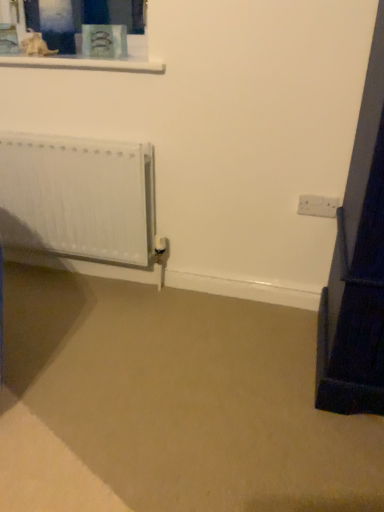
Describe the element at coordinates (317, 206) in the screenshot. I see `white plastic electric outlet at right` at that location.

Identify the location of white plastic electric outlet at right. (317, 206).

I want to click on white matte radiator at left, so click(78, 197).

The height and width of the screenshot is (512, 384). What do you see at coordinates (78, 197) in the screenshot?
I see `white matte radiator at left` at bounding box center [78, 197].

Where is `white plastic electric outlet at right`? white plastic electric outlet at right is located at coordinates (317, 206).

Can you confirm if white matte radiator at left is positioned to the left of white plastic electric outlet at right?

Yes, white matte radiator at left is to the left of white plastic electric outlet at right.

Based on the photo, is the position of white matte radiator at left less distant than that of white plastic electric outlet at right?

Yes, white matte radiator at left is in front of white plastic electric outlet at right.

Which is in front, point (85, 214) or point (313, 213)?

Point (313, 213)

From the image's perspective, which is below, white matte radiator at left or white plastic electric outlet at right?

white plastic electric outlet at right appears lower in the image.

From a real-world perspective, is white matte radiator at left physically located above or below white plastic electric outlet at right?

white matte radiator at left is situated lower than white plastic electric outlet at right in the real world.

Between white matte radiator at left and white plastic electric outlet at right, which one has smaller width?

white plastic electric outlet at right.

Is white matte radiator at left taller or shorter than white plastic electric outlet at right?

Clearly, white matte radiator at left is taller compared to white plastic electric outlet at right.

In terms of size, does white matte radiator at left appear bigger or smaller than white plastic electric outlet at right?

Considering their sizes, white matte radiator at left takes up more space than white plastic electric outlet at right.

Is white plastic electric outlet at right a part of white matte radiator at left?

No, white matte radiator at left does not contain white plastic electric outlet at right.

Is white matte radiator at left next to white plastic electric outlet at right and touching it?

white matte radiator at left and white plastic electric outlet at right are not in contact.

Looking at this image, is white matte radiator at left turned away from white plastic electric outlet at right?

white matte radiator at left is not turned away from white plastic electric outlet at right.

Identify the location of radiator above the white plastic electric outlet at right (from the image's perspective). The image size is (384, 512). (78, 197).

Considering the relative positions of white plastic electric outlet at right and white matte radiator at left in the image provided, is white plastic electric outlet at right to the left of white matte radiator at left from the viewer's perspective?

In fact, white plastic electric outlet at right is to the right of white matte radiator at left.

Who is more distant, white plastic electric outlet at right or white matte radiator at left?

white plastic electric outlet at right is behind.

Is point (329, 198) closer to camera compared to point (27, 245)?

Yes, point (329, 198) is in front of point (27, 245).

From the image's perspective, does white plastic electric outlet at right appear lower than white matte radiator at left?

Yes, from the image's perspective, white plastic electric outlet at right is below white matte radiator at left.

From a real-world perspective, is white plastic electric outlet at right positioned over white matte radiator at left based on gravity?

Yes, from a real-world perspective, white plastic electric outlet at right is over white matte radiator at left

Is white plastic electric outlet at right wider than white matte radiator at left?

No, white plastic electric outlet at right is not wider than white matte radiator at left.

Who is shorter, white plastic electric outlet at right or white matte radiator at left?

white plastic electric outlet at right is shorter.

Considering the sizes of white plastic electric outlet at right and white matte radiator at left in the image, is white plastic electric outlet at right bigger or smaller than white matte radiator at left?

white plastic electric outlet at right is smaller than white matte radiator at left.

Can we say white plastic electric outlet at right lies outside white matte radiator at left?

Yes, white plastic electric outlet at right is outside of white matte radiator at left.

In the scene shown: Are white plastic electric outlet at right and white matte radiator at left located far from each other?

They are positioned close to each other.

Is white plastic electric outlet at right looking in the opposite direction of white matte radiator at left?

That's not correct — white plastic electric outlet at right is not looking away from white matte radiator at left.

In the scene shown: How many degrees apart are the facing directions of white plastic electric outlet at right and white matte radiator at left?

There is a 0.955-degree angle between the facing directions of white plastic electric outlet at right and white matte radiator at left.

Where is `radiator above the white plastic electric outlet at right (from the image's perspective)`? radiator above the white plastic electric outlet at right (from the image's perspective) is located at coordinates (78, 197).

You are a GUI agent. You are given a task and a screenshot of the screen. Output one action in this format:
    pyautogui.click(x=<x>, y=<y>)
    Task: Click on the radiator located in front of the white plastic electric outlet at right
    Image resolution: width=384 pixels, height=512 pixels.
    Given the screenshot: What is the action you would take?
    pyautogui.click(x=78, y=197)

The height and width of the screenshot is (512, 384). In order to click on radiator above the white plastic electric outlet at right (from the image's perspective) in this screenshot , I will do `click(78, 197)`.